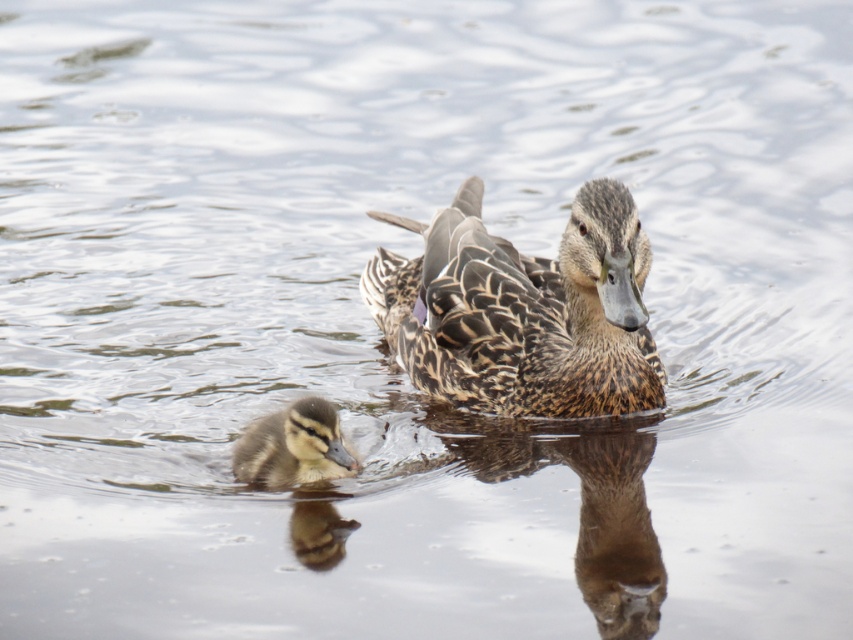
Does speckled feathered duckling at center have a greater width compared to brown fuzzy duckling at lower left?

Yes, speckled feathered duckling at center is wider than brown fuzzy duckling at lower left.

From the picture: Is speckled feathered duckling at center to the left of brown fuzzy duckling at lower left from the viewer's perspective?

Incorrect, speckled feathered duckling at center is not on the left side of brown fuzzy duckling at lower left.

You are a GUI agent. You are given a task and a screenshot of the screen. Output one action in this format:
    pyautogui.click(x=<x>, y=<y>)
    Task: Click on the speckled feathered duckling at center
    The image size is (853, 640).
    Given the screenshot: What is the action you would take?
    pyautogui.click(x=523, y=310)

Locate an element on the screen. This screenshot has width=853, height=640. speckled feathered duckling at center is located at coordinates coord(523,310).